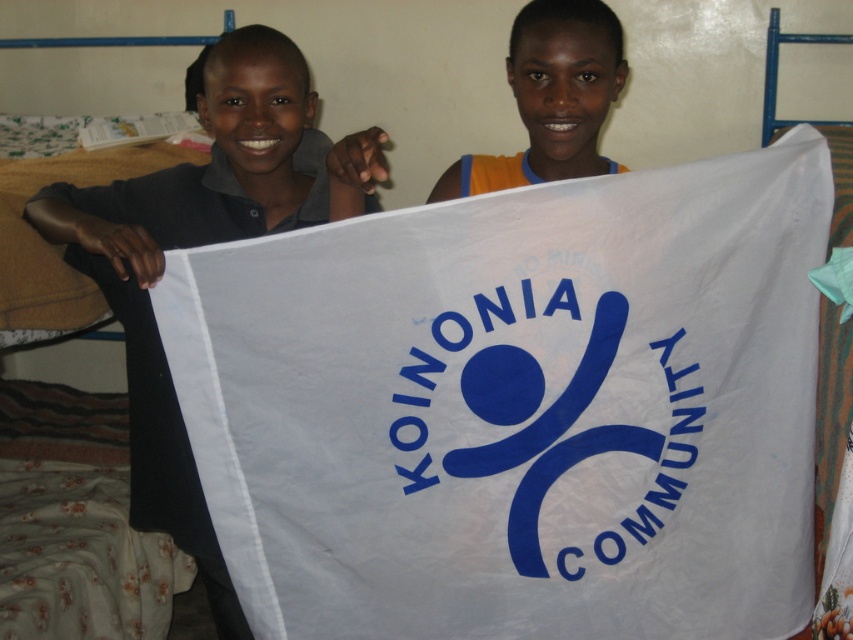
Can you confirm if blue fabric logo at center is positioned to the right of orange fabric at upper center?

In fact, blue fabric logo at center is to the left of orange fabric at upper center.

Is blue fabric logo at center to the left of orange fabric at upper center from the viewer's perspective?

Correct, you'll find blue fabric logo at center to the left of orange fabric at upper center.

Describe the element at coordinates (553, 426) in the screenshot. I see `blue fabric logo at center` at that location.

You are a GUI agent. You are given a task and a screenshot of the screen. Output one action in this format:
    pyautogui.click(x=<x>, y=<y>)
    Task: Click on the blue fabric logo at center
    Image resolution: width=853 pixels, height=640 pixels.
    Given the screenshot: What is the action you would take?
    pyautogui.click(x=553, y=426)

Does white fabric flag at center have a lesser width compared to orange fabric at upper center?

In fact, white fabric flag at center might be wider than orange fabric at upper center.

Which is behind, point (467, 216) or point (521, 45)?

Positioned behind is point (521, 45).

Locate an element on the screen. Image resolution: width=853 pixels, height=640 pixels. white fabric flag at center is located at coordinates (518, 406).

Does dark gray shirt at left appear on the left side of blue fabric logo at center?

Yes, dark gray shirt at left is to the left of blue fabric logo at center.

Between dark gray shirt at left and blue fabric logo at center, which one appears on the left side from the viewer's perspective?

dark gray shirt at left is more to the left.

Does point (100, 234) come farther from viewer compared to point (670, 396)?

Yes, it is.

Where is `dark gray shirt at left`? The image size is (853, 640). dark gray shirt at left is located at coordinates pyautogui.click(x=204, y=244).